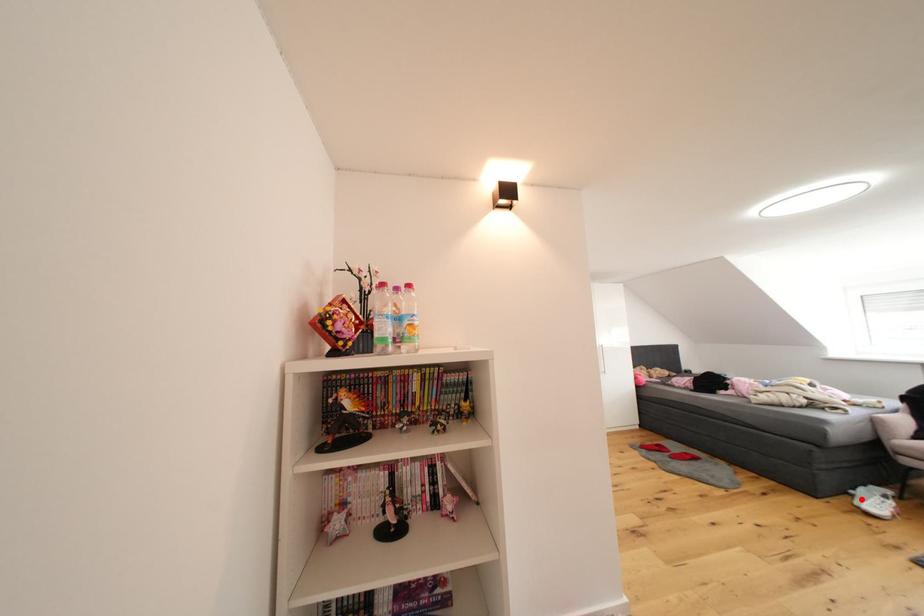
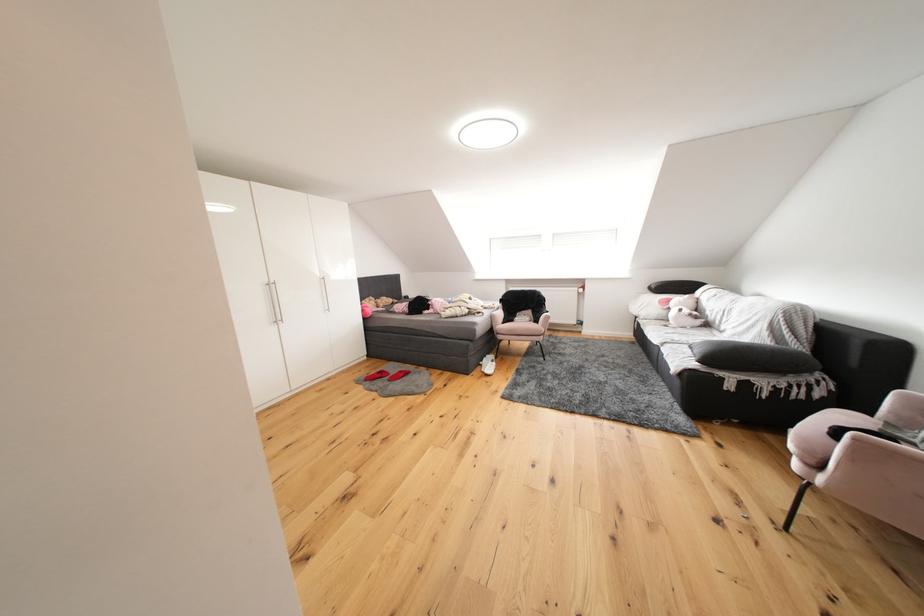
Question: I am providing you with two images of the same scene from different viewpoints. Image1 has a red point marked. In image2, the corresponding 3D location appears at what relative position? Reply with the corresponding letter.

Choices:
 (A) Closer
 (B) Farther

Answer: (B)